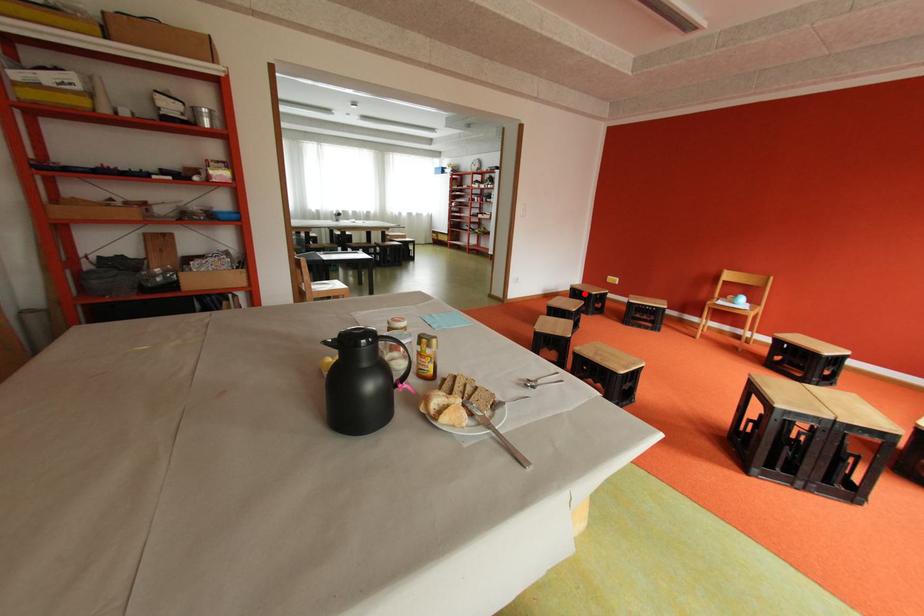
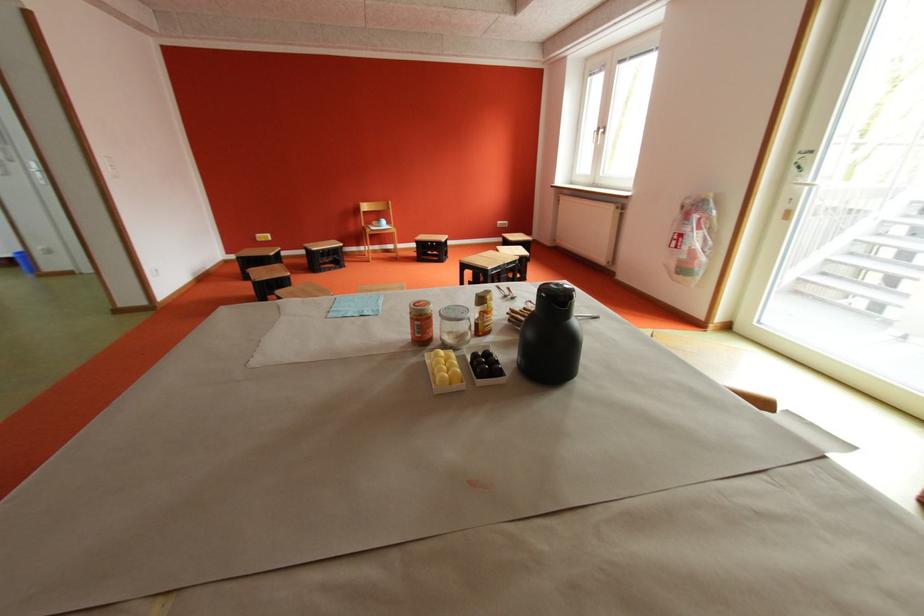
In the second image, find the point that corresponds to the highlighted location in the first image.

(257, 262)